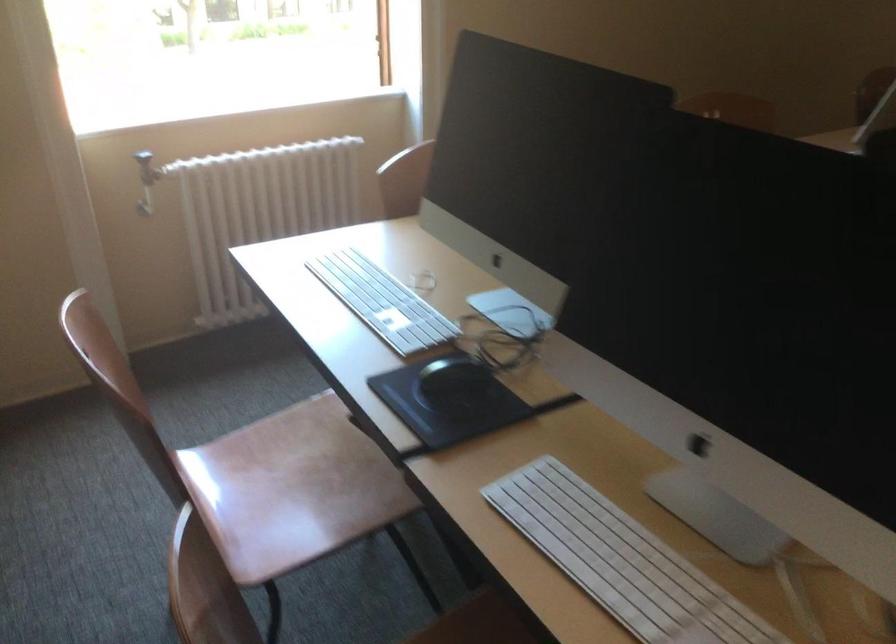
Where is `radiator valve`? This screenshot has width=896, height=644. radiator valve is located at coordinates (147, 167).